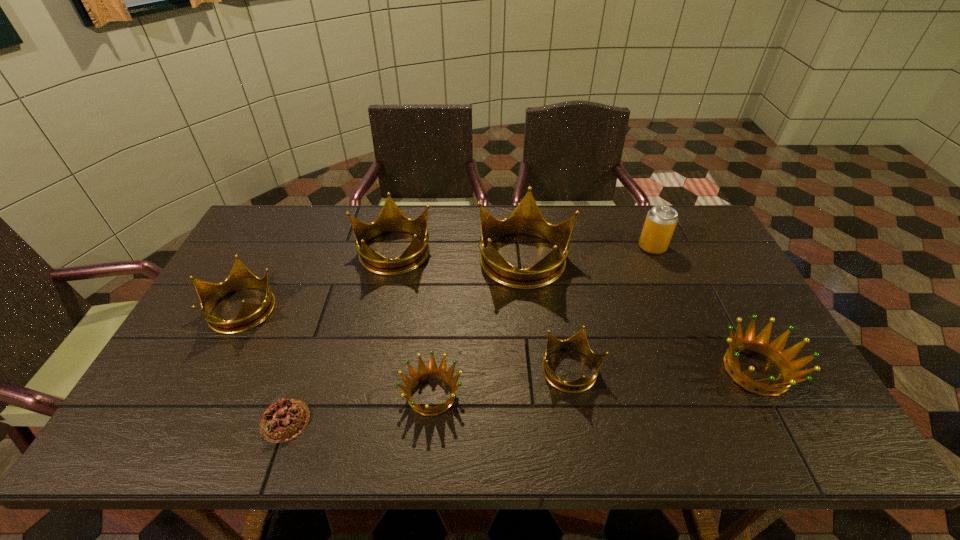
Locate an element on the screen. This screenshot has height=540, width=960. free space located on the back of the chocolate cake is located at coordinates (299, 381).

You are a GUI agent. You are given a task and a screenshot of the screen. Output one action in this format:
    pyautogui.click(x=<x>, y=<y>)
    Task: Click on the pop (soda) located at the far edge
    
    Given the screenshot: What is the action you would take?
    pyautogui.click(x=661, y=220)

The width and height of the screenshot is (960, 540). In order to click on crown at the near edge in this screenshot , I will do `click(423, 373)`.

The height and width of the screenshot is (540, 960). In order to click on chocolate cake that is at the near edge in this screenshot , I will do `click(284, 420)`.

I want to click on object that is positioned at the left edge, so click(250, 315).

At what (x,y) coordinates should I click in order to perform the action: click on object located at the right edge. Please return your answer as a coordinate pair (x, y). The width and height of the screenshot is (960, 540). Looking at the image, I should click on (773, 350).

At what (x,y) coordinates should I click in order to perform the action: click on vacant area at the far edge of the desktop. Please return your answer as a coordinate pair (x, y). The width and height of the screenshot is (960, 540). Looking at the image, I should click on (628, 235).

At what (x,y) coordinates should I click in order to perform the action: click on vacant space at the near edge of the desktop. Please return your answer as a coordinate pair (x, y). The height and width of the screenshot is (540, 960). Looking at the image, I should click on (440, 437).

In the image, there is a desktop. Where is `vacant space at the left edge`? vacant space at the left edge is located at coordinates (228, 334).

What are the coordinates of `vacant area that lies between the third biggest gold crown and the bigger golden crown` in the screenshot? It's located at (498, 339).